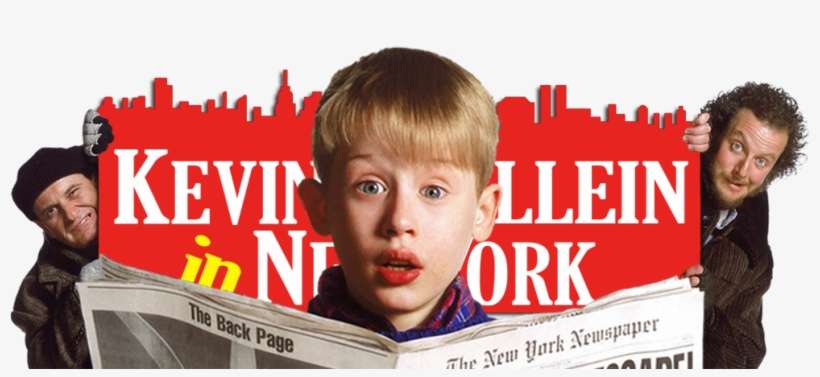
Locate an element on the screen. Image resolution: width=820 pixels, height=377 pixels. newspaper is located at coordinates (594, 335).